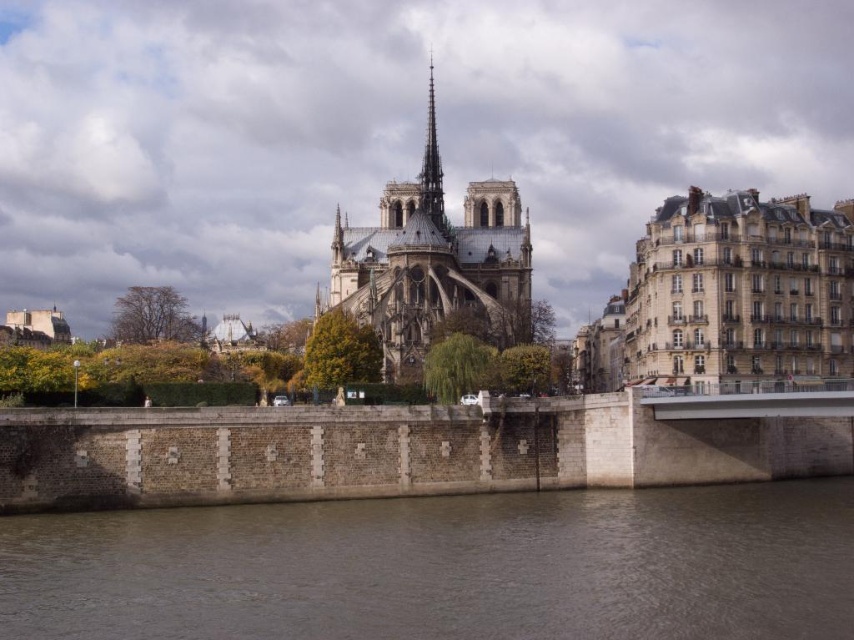
What do you see at coordinates (445, 566) in the screenshot?
I see `brown stone wall at lower center` at bounding box center [445, 566].

Between brown stone wall at lower center and concrete bridge at center, which one has more height?

With more height is concrete bridge at center.

Which is behind, point (820, 596) or point (638, 472)?

Point (638, 472)

I want to click on brown stone wall at lower center, so click(x=445, y=566).

The height and width of the screenshot is (640, 854). In order to click on concrete bridge at center in this screenshot , I will do `click(390, 451)`.

Between concrete bridge at center and smooth gray spire at center, which one has more height?

Standing taller between the two is smooth gray spire at center.

What do you see at coordinates (390, 451) in the screenshot?
I see `concrete bridge at center` at bounding box center [390, 451].

The image size is (854, 640). I want to click on concrete bridge at center, so coord(390,451).

Who is taller, stone gothic cathedral at center or smooth gray spire at center?

Standing taller between the two is stone gothic cathedral at center.

Which is behind, point (436, 209) or point (430, 205)?

Point (436, 209)

Identify the location of stone gothic cathedral at center. (434, 266).